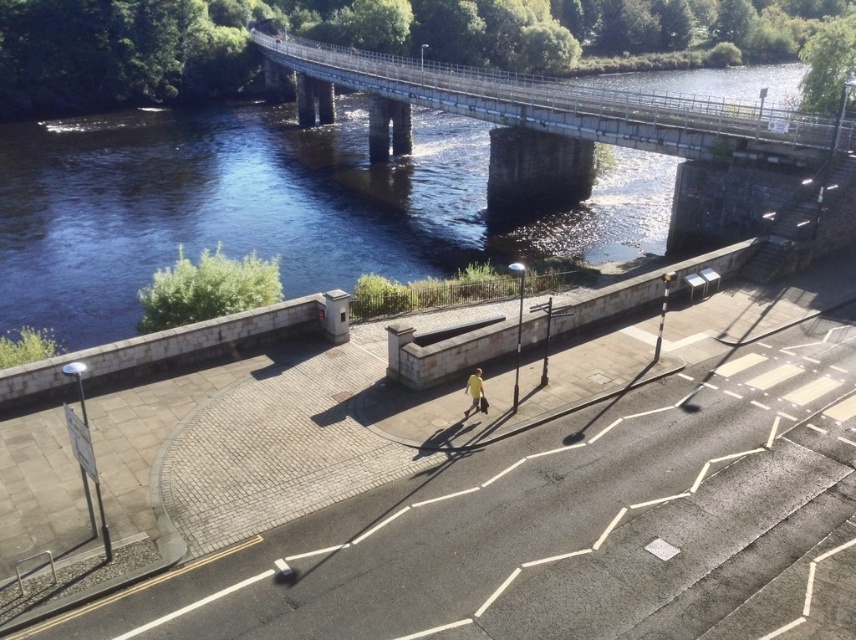
Is point (434, 163) more distant than point (477, 392)?

Yes, point (434, 163) is behind point (477, 392).

The image size is (856, 640). Describe the element at coordinates (270, 205) in the screenshot. I see `dark blue water at upper center` at that location.

Where is `dark blue water at upper center`? The image size is (856, 640). dark blue water at upper center is located at coordinates (270, 205).

Is metallic gray bridge at upper center thinner than yellow fabric at center?

No.

Is point (508, 97) positioned before point (479, 410)?

No, (508, 97) is further to viewer.

Is point (669, 115) closer to camera compared to point (477, 371)?

No, it is not.

Locate an element on the screen. The width and height of the screenshot is (856, 640). metallic gray bridge at upper center is located at coordinates click(x=569, y=106).

Consider the image. Who is shorter, dark blue water at upper center or metallic gray bridge at upper center?

dark blue water at upper center

Between dark blue water at upper center and metallic gray bridge at upper center, which one is positioned lower?

Positioned lower is dark blue water at upper center.

Describe the element at coordinates (270, 205) in the screenshot. I see `dark blue water at upper center` at that location.

The image size is (856, 640). Find the location of `dark blue water at upper center`. dark blue water at upper center is located at coordinates (270, 205).